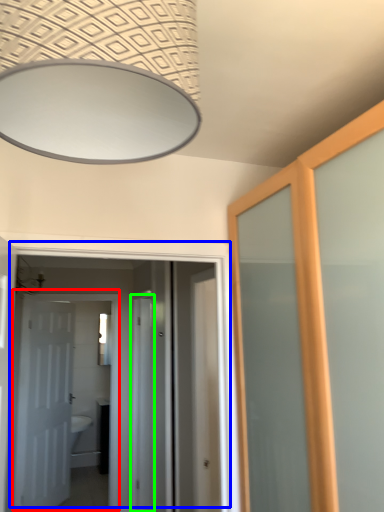
Question: Estimate the real-world distances between objects in this image. Which object is farther from door (highlighted by a red box), door (highlighted by a blue box) or screen door (highlighted by a green box)?

Choices:
 (A) door
 (B) screen door

Answer: (B)